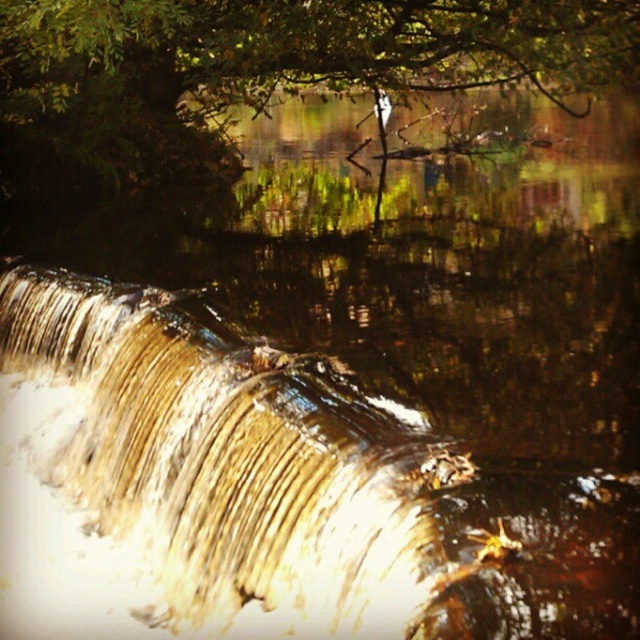
You are a photographer planning to capture the golden smooth waterfall at center and the green leafy tree at upper center in the same frame. Based on their sizes in the image, which object would appear more prominent in the final photo?

The green leafy tree at upper center would appear more prominent in the final photo because it is larger than the golden smooth waterfall at center.

You are standing at the point marked as point (x=310, y=596) in the image. You want to throw a stone to hit a target located 14.57 feet away from your current position. Is the distance between you and the target exactly the required distance for the stone to reach the target?

Yes, the distance between point (x=310, y=596) and the target is exactly 14.57 feet, so the stone will reach the target if thrown accurately.

What is the relationship between the height of the golden smooth waterfall at center and the green leafy tree at upper center in the image?

The golden smooth waterfall at center has a lesser height compared to the green leafy tree at upper center.